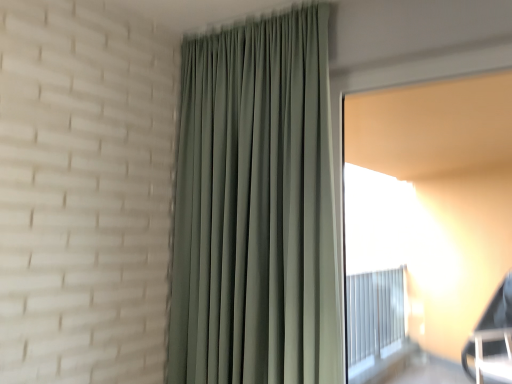
Image resolution: width=512 pixels, height=384 pixels. In order to click on free spot above white matte window screen at right (from a real-world perspective) in this screenshot , I will do `click(414, 67)`.